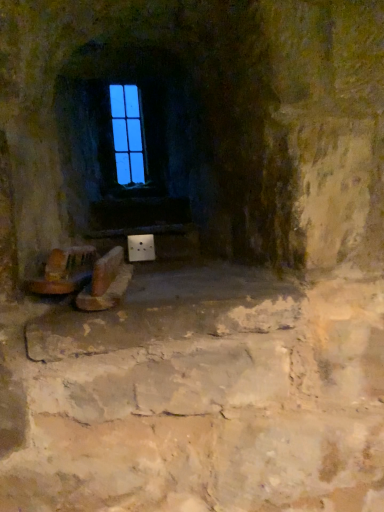
Question: Is blue glass window at upper center at the right side of wooden chair at lower left?

Choices:
 (A) yes
 (B) no

Answer: (B)

Question: Can you confirm if blue glass window at upper center is bigger than wooden chair at lower left?

Choices:
 (A) yes
 (B) no

Answer: (B)

Question: Does blue glass window at upper center lie in front of wooden chair at lower left?

Choices:
 (A) no
 (B) yes

Answer: (A)

Question: Is blue glass window at upper center thinner than wooden chair at lower left?

Choices:
 (A) no
 (B) yes

Answer: (B)

Question: Could you tell me if blue glass window at upper center is facing wooden chair at lower left?

Choices:
 (A) yes
 (B) no

Answer: (A)

Question: Visually, is blue glass window at upper center positioned to the left or to the right of brown leather shoes at lower center?

Choices:
 (A) right
 (B) left

Answer: (B)

Question: Is point (100, 116) positioned closer to the camera than point (79, 309)?

Choices:
 (A) closer
 (B) farther

Answer: (B)

Question: Considering their positions, is blue glass window at upper center located in front of or behind brown leather shoes at lower center?

Choices:
 (A) front
 (B) behind

Answer: (B)

Question: Looking at the image, does blue glass window at upper center seem bigger or smaller compared to brown leather shoes at lower center?

Choices:
 (A) big
 (B) small

Answer: (B)

Question: Looking at their shapes, would you say brown leather shoes at lower center is wider or thinner than wooden chair at lower left?

Choices:
 (A) thin
 (B) wide

Answer: (B)

Question: Do you think brown leather shoes at lower center is within wooden chair at lower left, or outside of it?

Choices:
 (A) outside
 (B) inside

Answer: (A)

Question: In terms of height, does brown leather shoes at lower center look taller or shorter compared to wooden chair at lower left?

Choices:
 (A) tall
 (B) short

Answer: (A)

Question: Relative to wooden chair at lower left, is brown leather shoes at lower center in front or behind?

Choices:
 (A) front
 (B) behind

Answer: (A)

Question: In the image, is brown leather shoes at lower center on the left side or the right side of blue glass window at upper center?

Choices:
 (A) right
 (B) left

Answer: (A)

Question: Does point (89, 284) appear closer or farther from the camera than point (122, 142)?

Choices:
 (A) farther
 (B) closer

Answer: (B)